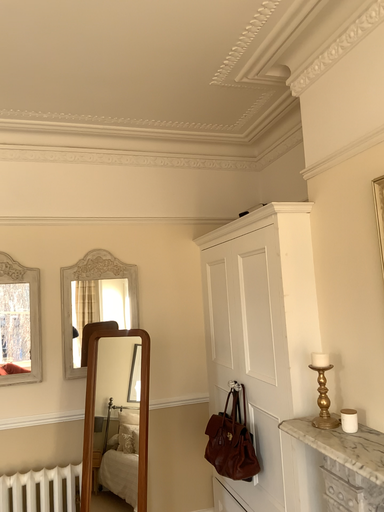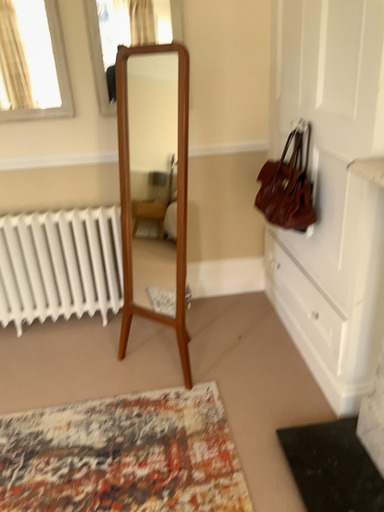
Question: Which way did the camera rotate in the video?

Choices:
 (A) rotated left
 (B) rotated right

Answer: (A)